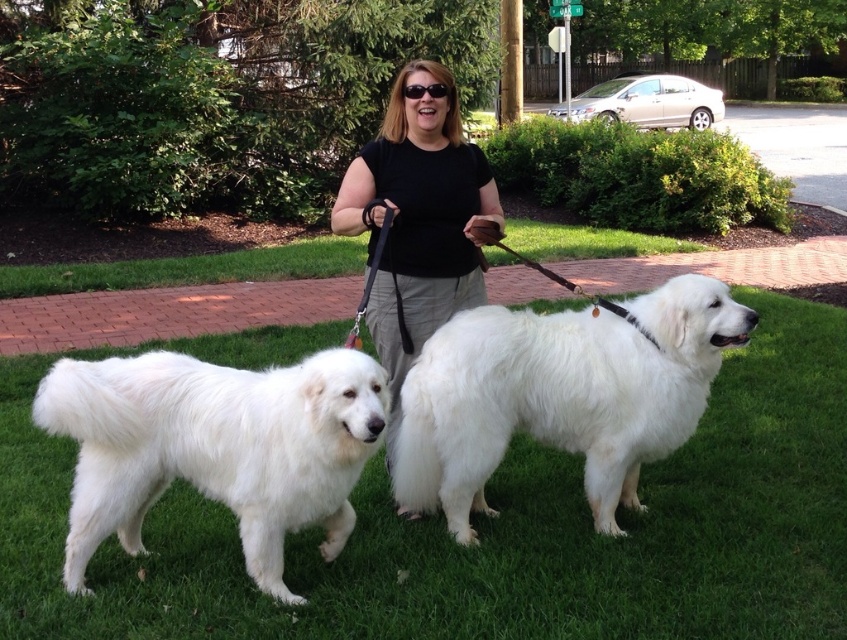
Does green grass at center have a larger size compared to white fluffy dog at center?

Actually, green grass at center might be smaller than white fluffy dog at center.

Is point (327, 586) closer to viewer compared to point (414, 474)?

Yes, point (327, 586) is closer to viewer.

In the scene shown: Who is more forward, (681,529) or (722,339)?

Point (722,339) is more forward.

Locate an element on the screen. The height and width of the screenshot is (640, 847). green grass at center is located at coordinates (490, 531).

Does white fluffy dog at lower left have a lesser height compared to black fabric shirt at center?

Yes, white fluffy dog at lower left is shorter than black fabric shirt at center.

Does point (180, 378) come behind point (450, 234)?

No, (180, 378) is closer to viewer.

I want to click on white fluffy dog at lower left, so click(x=214, y=448).

Which is below, green grass at center or black fabric shirt at center?

green grass at center is lower down.

Who is more distant from viewer, (807,355) or (471,305)?

Point (807,355)

Where is `green grass at center`? The width and height of the screenshot is (847, 640). green grass at center is located at coordinates (490, 531).